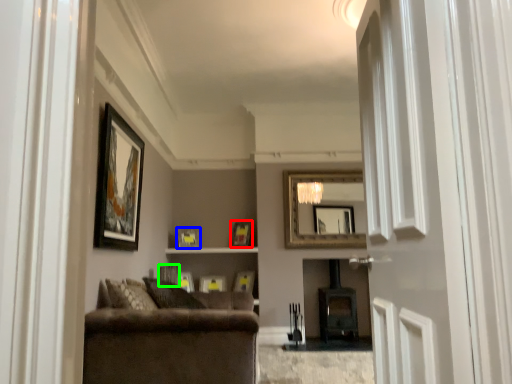
Question: Which object is the closest to the picture frame (highlighted by a red box)? Choose among these: picture frame (highlighted by a blue box) or picture frame (highlighted by a green box).

Choices:
 (A) picture frame
 (B) picture frame

Answer: (A)